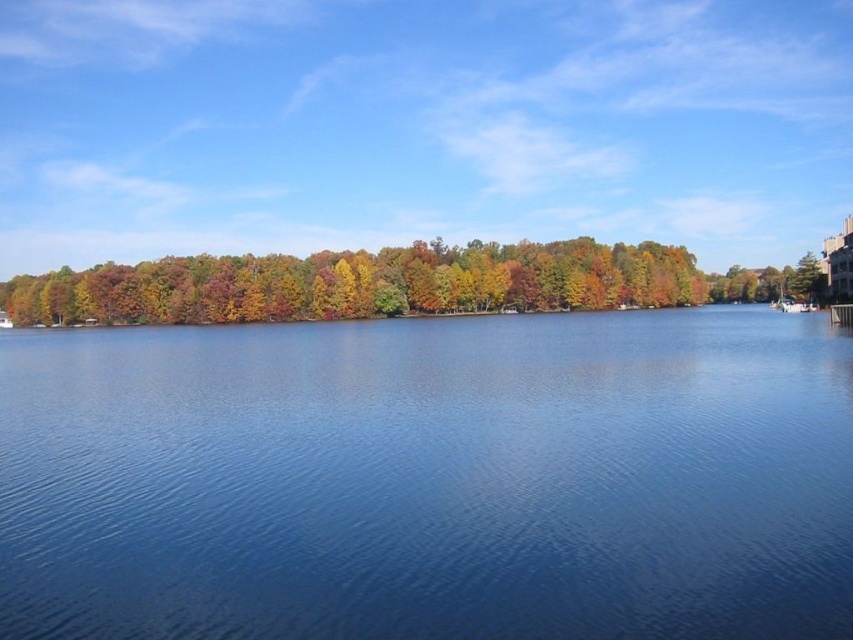
Is the position of blue water at center less distant than that of white plastic boat at right?

Yes, blue water at center is closer to the viewer.

Does point (170, 412) come in front of point (808, 305)?

Yes, it is in front of point (808, 305).

Identify the location of blue water at center. (430, 480).

Can you confirm if autumn leaves at center is positioned to the left of white plastic boat at right?

Yes, autumn leaves at center is to the left of white plastic boat at right.

Does point (273, 312) come in front of point (799, 310)?

No, (273, 312) is behind (799, 310).

Where is `autumn leaves at center`? autumn leaves at center is located at coordinates (390, 284).

Is blue water at center closer to camera compared to autumn leaves at center?

Yes, it is.

Is blue water at center above autumn leaves at center?

No, blue water at center is not above autumn leaves at center.

Where is `blue water at center`? The height and width of the screenshot is (640, 853). blue water at center is located at coordinates (430, 480).

I want to click on blue water at center, so click(430, 480).